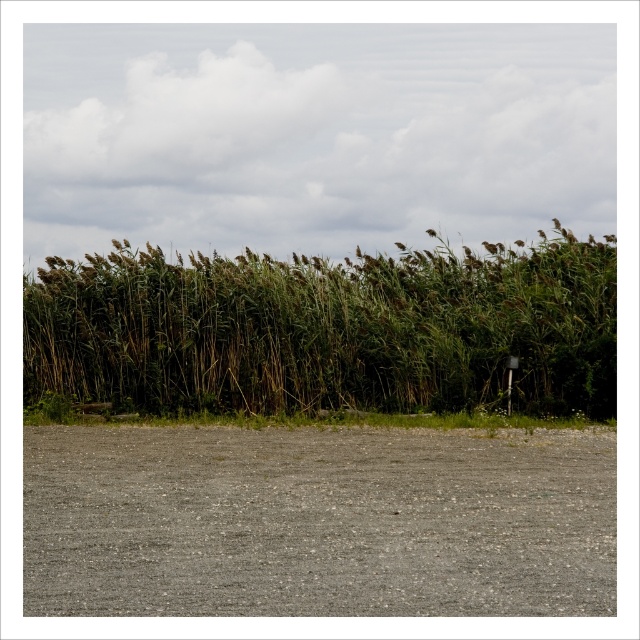
Locate an element on the screen. The width and height of the screenshot is (640, 640). gray gravelly dirt field at lower center is located at coordinates (317, 522).

From the picture: Who is more distant from viewer, (428, 456) or (129, 332)?

Point (129, 332)

At what (x,y) coordinates should I click in order to perform the action: click on gray gravelly dirt field at lower center. Please return your answer as a coordinate pair (x, y). The image size is (640, 640). Looking at the image, I should click on (317, 522).

Can you confirm if gray gravelly dirt field at lower center is positioned above green grass at bottom?

Yes, gray gravelly dirt field at lower center is above green grass at bottom.

Between gray gravelly dirt field at lower center and green grass at bottom, which one appears on the left side from the viewer's perspective?

green grass at bottom is more to the left.

Who is more forward, (129,563) or (307,422)?

Positioned in front is point (129,563).

You are a GUI agent. You are given a task and a screenshot of the screen. Output one action in this format:
    pyautogui.click(x=<x>, y=<y>)
    Task: Click on the gray gravelly dirt field at lower center
    
    Given the screenshot: What is the action you would take?
    pyautogui.click(x=317, y=522)

Who is positioned more to the right, green grassy reeds at upper center or green grass at bottom?

green grassy reeds at upper center

Can you confirm if green grassy reeds at upper center is positioned above green grass at bottom?

Correct, green grassy reeds at upper center is located above green grass at bottom.

Who is more distant from viewer, (368,385) or (438,419)?

The point (368,385) is behind.

Where is `green grassy reeds at upper center`? Image resolution: width=640 pixels, height=640 pixels. green grassy reeds at upper center is located at coordinates (328, 330).